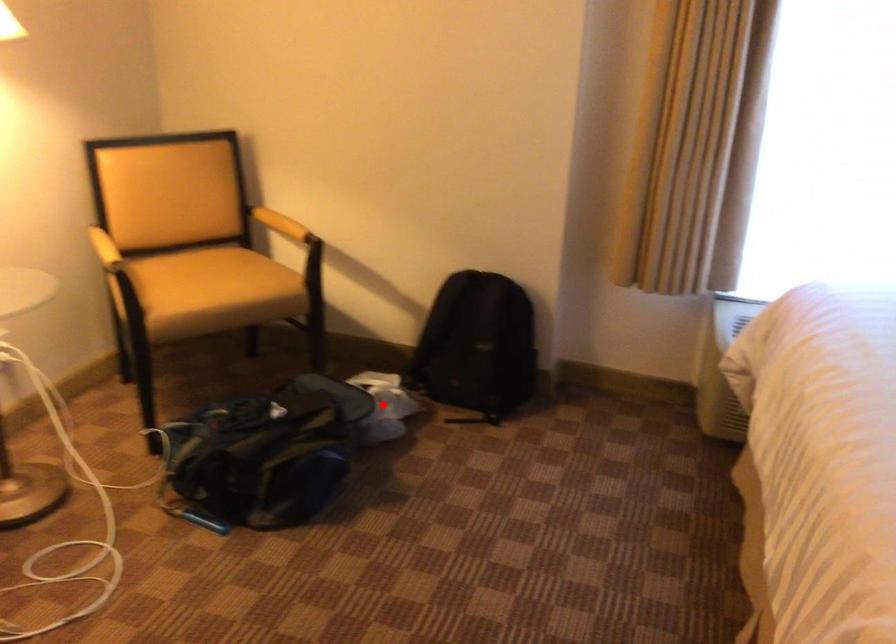
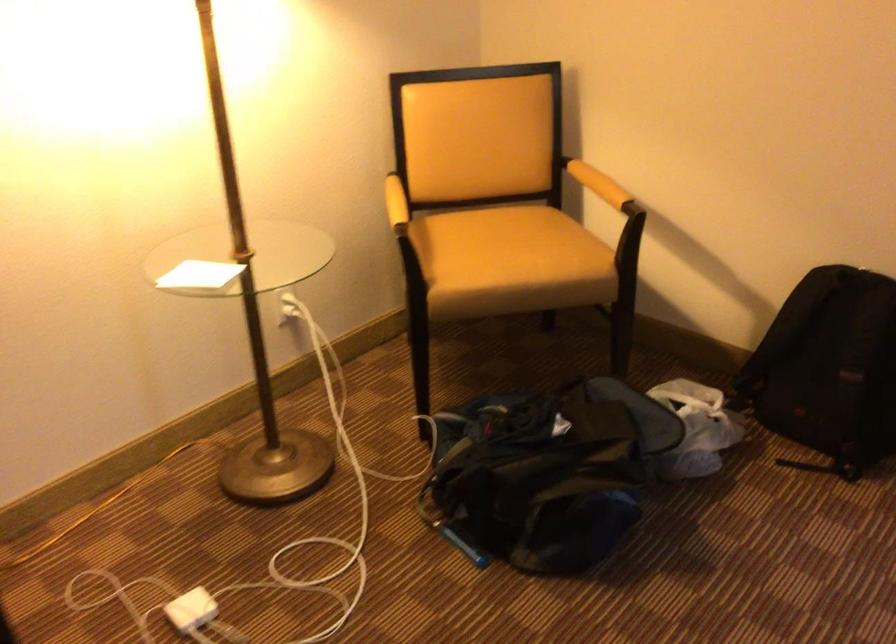
Question: I am providing you with two images of the same scene from different viewpoints. A red point is shown in image1. For the corresponding object point in image2, is it positioned nearer or farther from the camera?

Choices:
 (A) Nearer
 (B) Farther

Answer: (A)